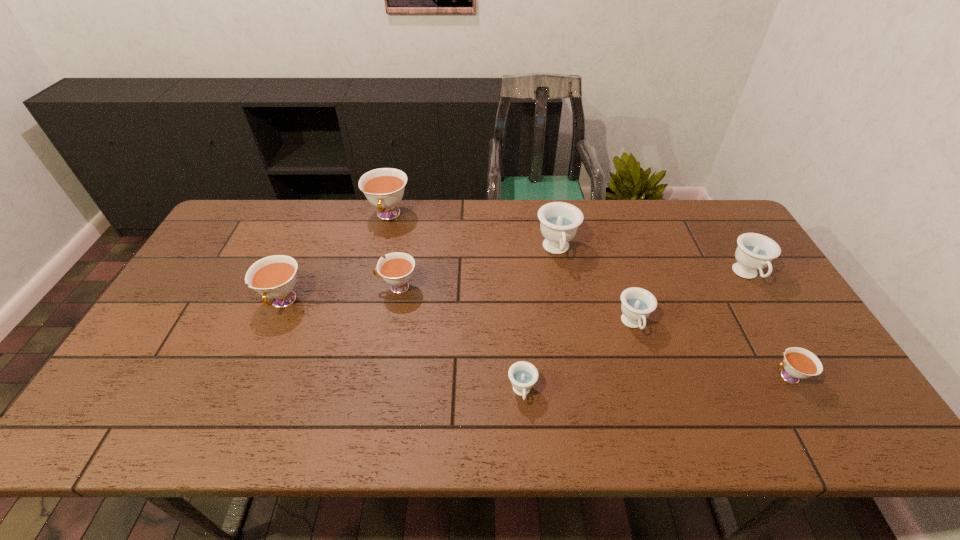
The width and height of the screenshot is (960, 540). I want to click on the smallest white teacup, so click(x=799, y=363).

Find the location of `the rightmost white teacup`. the rightmost white teacup is located at coordinates (799, 363).

The height and width of the screenshot is (540, 960). Find the location of `the fifth object from right to left`. the fifth object from right to left is located at coordinates (523, 375).

Where is `the fourth teacup from left to right`? The height and width of the screenshot is (540, 960). the fourth teacup from left to right is located at coordinates pyautogui.click(x=523, y=375).

Locate an element on the screen. vacant region located 0.330m on the side of the farthest object with the handle is located at coordinates (367, 307).

Find the location of a particular element. free space located on the side of the fourth object from right to left with the handle is located at coordinates (577, 361).

This screenshot has width=960, height=540. In order to click on vacant space situated 0.250m on the side of the leftmost white teacup with the handle in this screenshot , I will do `click(239, 408)`.

Where is `free region located 0.280m on the side of the rightmost blue teacup with the handle`? This screenshot has height=540, width=960. free region located 0.280m on the side of the rightmost blue teacup with the handle is located at coordinates (809, 378).

What are the coordinates of `free region located 0.340m on the side of the third biggest white teacup with the handle` in the screenshot? It's located at (260, 287).

The image size is (960, 540). I want to click on vacant space located 0.390m on the side of the third biggest white teacup with the handle, so click(x=243, y=287).